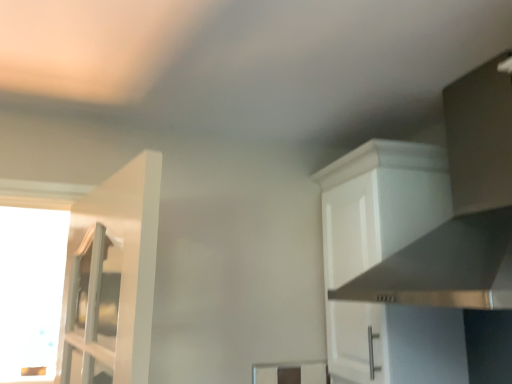
Question: Considering the relative sizes of stainless steel vent at upper right and transparent glass window at left in the image provided, is stainless steel vent at upper right wider than transparent glass window at left?

Choices:
 (A) yes
 (B) no

Answer: (A)

Question: Considering the relative sizes of stainless steel vent at upper right and transparent glass window at left in the image provided, is stainless steel vent at upper right bigger than transparent glass window at left?

Choices:
 (A) yes
 (B) no

Answer: (A)

Question: Could you tell me if stainless steel vent at upper right is turned towards transparent glass window at left?

Choices:
 (A) yes
 (B) no

Answer: (B)

Question: From the image's perspective, would you say stainless steel vent at upper right is shown under transparent glass window at left?

Choices:
 (A) yes
 (B) no

Answer: (B)

Question: From a real-world perspective, is stainless steel vent at upper right below transparent glass window at left?

Choices:
 (A) yes
 (B) no

Answer: (B)

Question: Is stainless steel vent at upper right wider or thinner than transparent glass window at left?

Choices:
 (A) thin
 (B) wide

Answer: (B)

Question: Is stainless steel vent at upper right bigger or smaller than transparent glass window at left?

Choices:
 (A) big
 (B) small

Answer: (A)

Question: From a real-world perspective, relative to transparent glass window at left, is stainless steel vent at upper right vertically above or below?

Choices:
 (A) below
 (B) above

Answer: (B)

Question: From their relative heights in the image, would you say stainless steel vent at upper right is taller or shorter than transparent glass window at left?

Choices:
 (A) short
 (B) tall

Answer: (A)

Question: From the image's perspective, is white matte cabinet at upper right above or below transparent glass window at left?

Choices:
 (A) below
 (B) above

Answer: (B)

Question: Does point (378, 193) appear closer or farther from the camera than point (37, 276)?

Choices:
 (A) farther
 (B) closer

Answer: (B)

Question: Considering the positions of white matte cabinet at upper right and transparent glass window at left in the image, is white matte cabinet at upper right wider or thinner than transparent glass window at left?

Choices:
 (A) wide
 (B) thin

Answer: (A)

Question: Considering the positions of white matte cabinet at upper right and transparent glass window at left in the image, is white matte cabinet at upper right bigger or smaller than transparent glass window at left?

Choices:
 (A) small
 (B) big

Answer: (A)

Question: In terms of size, does transparent glass window at left appear bigger or smaller than white matte cabinet at upper right?

Choices:
 (A) big
 (B) small

Answer: (A)

Question: Looking at their shapes, would you say transparent glass window at left is wider or thinner than white matte cabinet at upper right?

Choices:
 (A) thin
 (B) wide

Answer: (A)